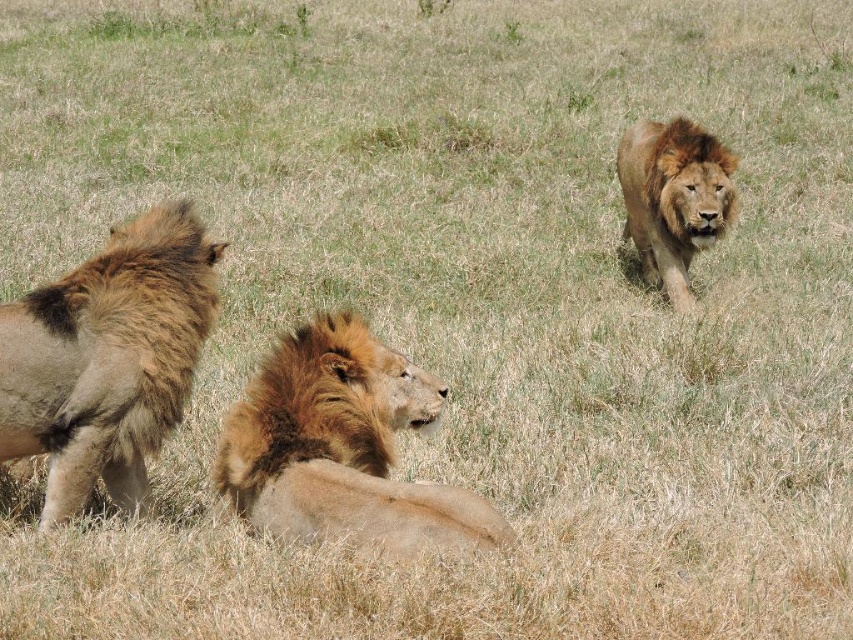
You are a photographer trying to capture a closeup of the lion in the background. You have a zoom lens that can focus on a specific point. Which of the two points, point (178, 241) or point (693, 205), should you focus on to get the sharpest image of the background lion?

Point (693, 205) is farther from the camera than point (178, 241), so focusing on point (693, 205) will capture the background lion more sharply.